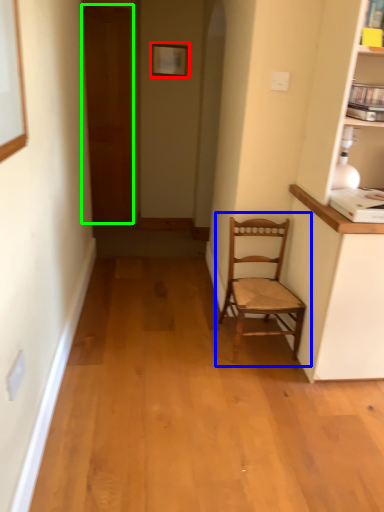
Question: Considering the real-world distances, which object is closest to picture frame (highlighted by a red box)? chair (highlighted by a blue box) or door (highlighted by a green box).

Choices:
 (A) chair
 (B) door

Answer: (B)